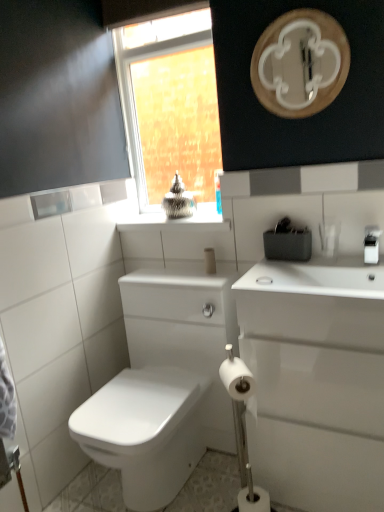
Find the location of a particular element. The width and height of the screenshot is (384, 512). empty space that is to the right of white matte soap at center is located at coordinates (298, 283).